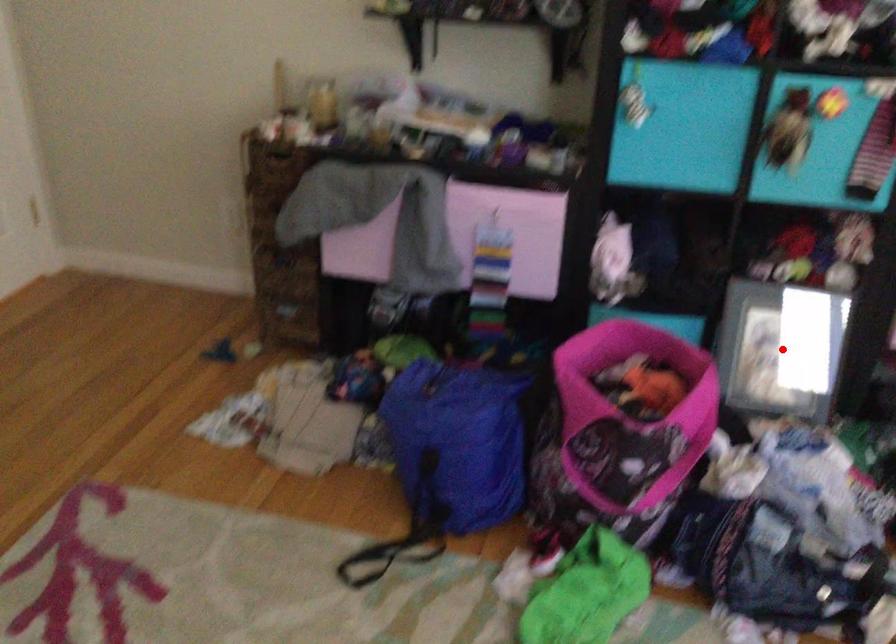
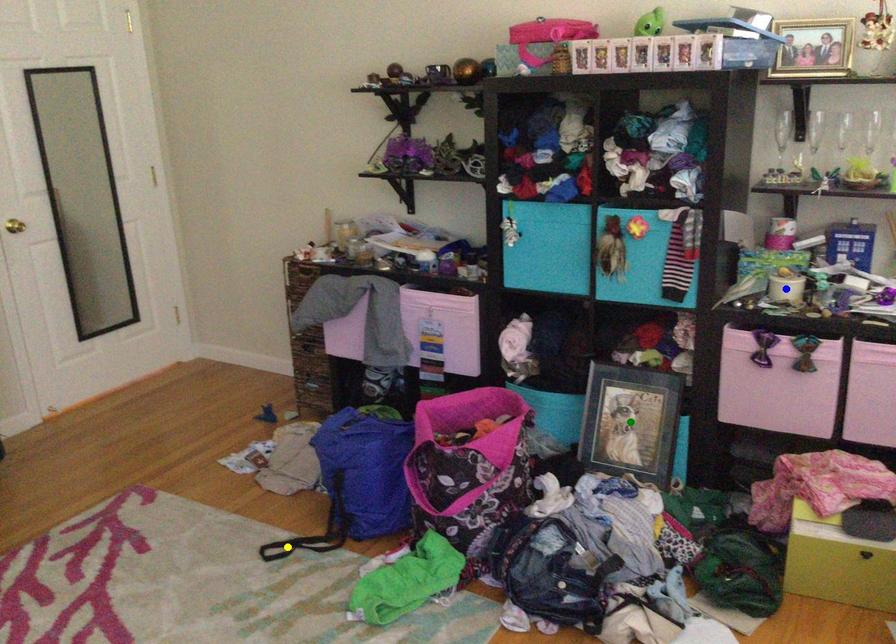
Question: I am providing you with two images of the same scene from different viewpoints. A red point is marked on the first image. You are given multiple points on the second image. Which point in image 2 is actually the same real-world point as the red point in image 1?

Choices:
 (A) green point
 (B) blue point
 (C) yellow point

Answer: (A)